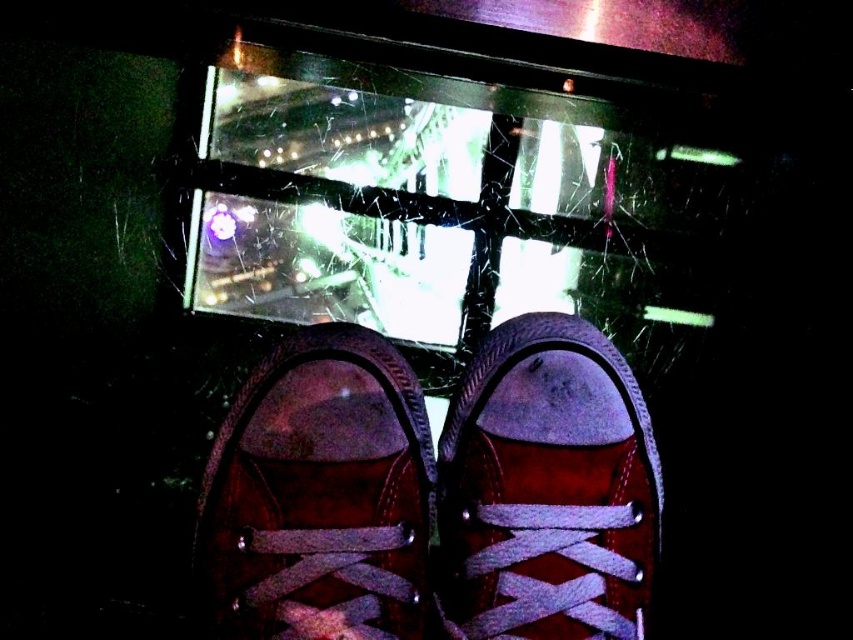
Question: Among these points, which one is nearest to the camera?

Choices:
 (A) click(457, 518)
 (B) click(410, 380)

Answer: (A)

Question: Does shiny brown shoe at center have a greater width compared to suede/leather sneaker at center?

Choices:
 (A) yes
 (B) no

Answer: (A)

Question: In this image, where is shiny brown shoe at center located relative to suede/leather sneaker at center?

Choices:
 (A) left
 (B) right

Answer: (A)

Question: Can you confirm if shiny brown shoe at center is positioned to the left of suede/leather sneaker at center?

Choices:
 (A) no
 (B) yes

Answer: (B)

Question: Which point is farther to the camera?

Choices:
 (A) (383, 452)
 (B) (608, 442)

Answer: (B)